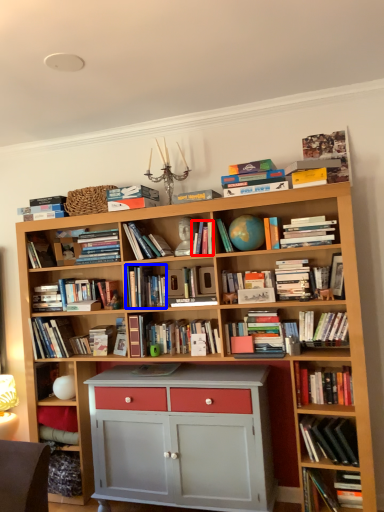
Question: Which object appears farthest to the camera in this image, book (highlighted by a red box) or book (highlighted by a blue box)?

Choices:
 (A) book
 (B) book

Answer: (B)